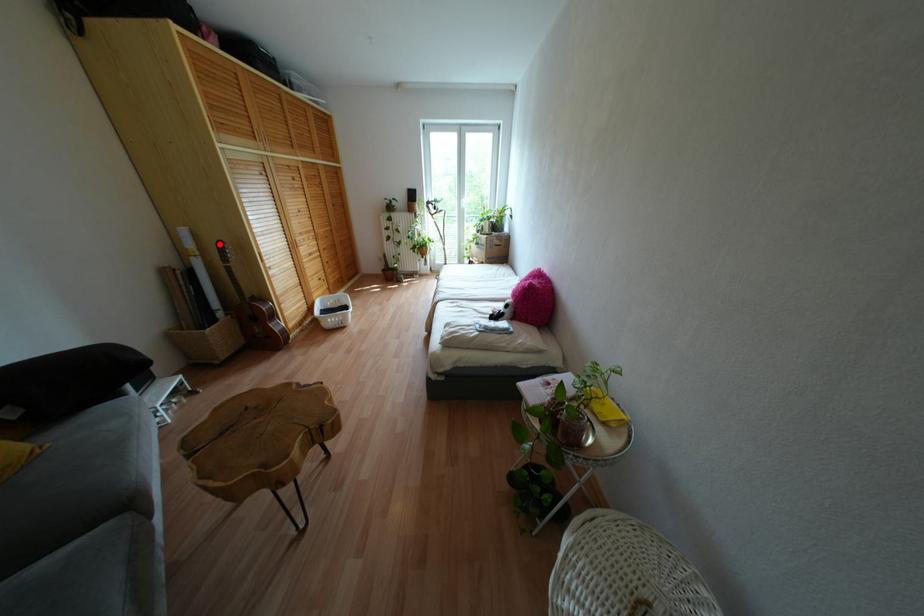
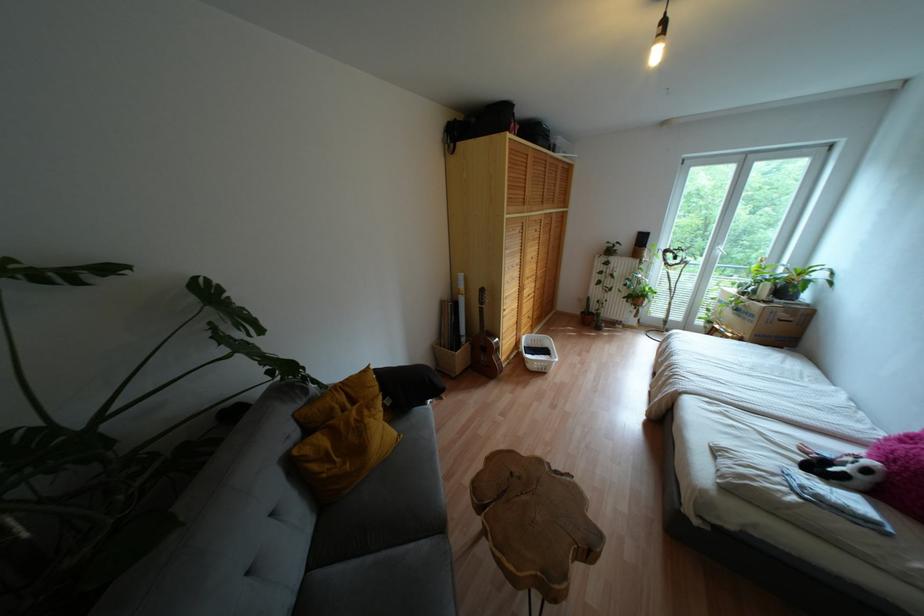
Where in the second image is the point corresponding to the highlighted location from the first image?

(481, 290)